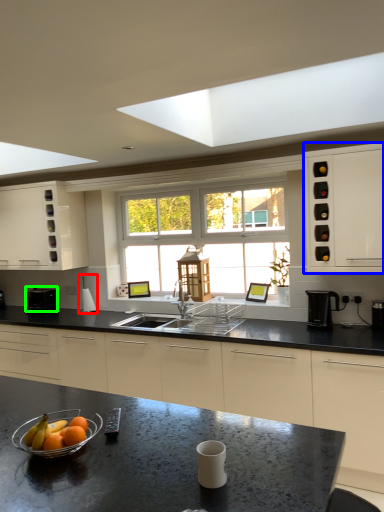
Question: Estimate the real-world distances between objects in this image. Which object is farther from appliance (highlighted by a red box), cabinetry (highlighted by a blue box) or appliance (highlighted by a green box)?

Choices:
 (A) cabinetry
 (B) appliance

Answer: (A)